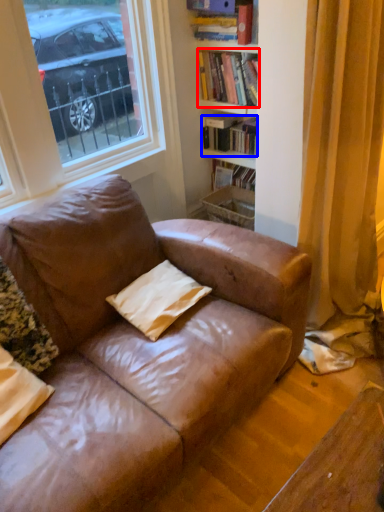
Question: Which object is further to the camera taking this photo, book (highlighted by a red box) or book (highlighted by a blue box)?

Choices:
 (A) book
 (B) book

Answer: (B)